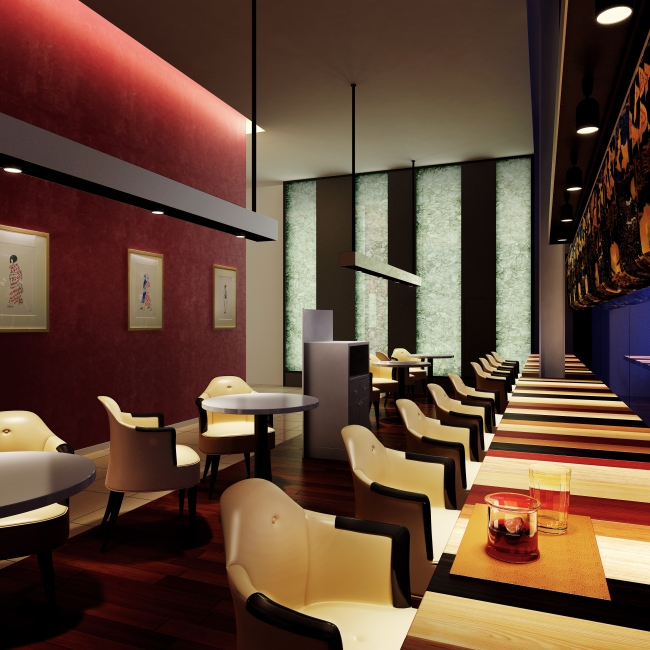
This screenshot has height=650, width=650. In order to click on light fixture in this screenshot , I will do `click(166, 202)`, `click(389, 273)`, `click(569, 162)`.